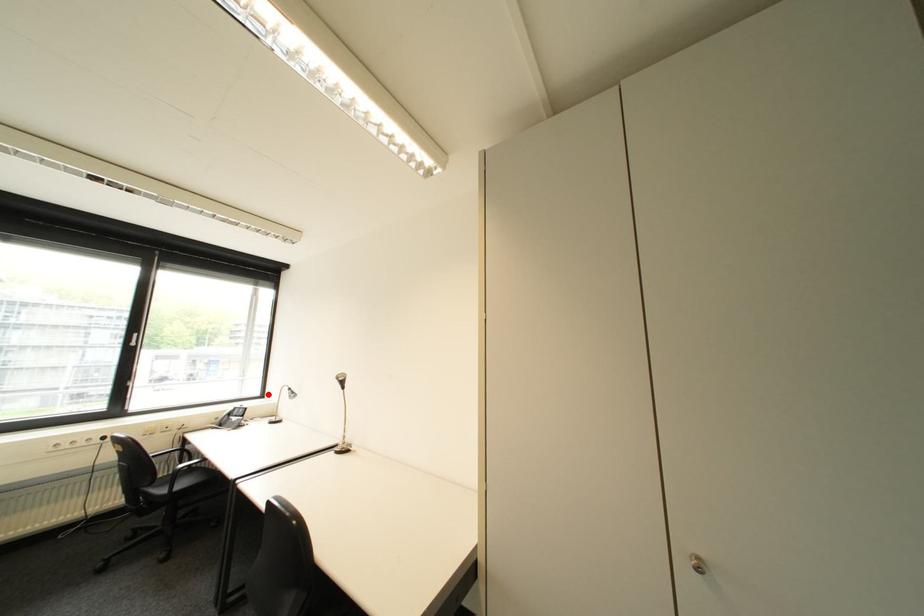
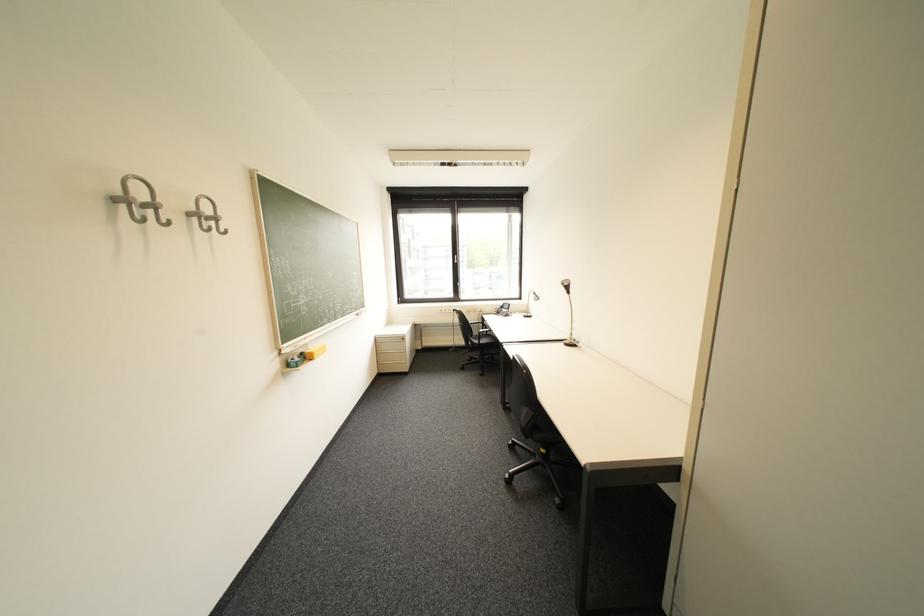
Question: I am providing you with two images of the same scene from different viewpoints. Given a red point in image1, look at the same physical point in image2. Is it:

Choices:
 (A) Closer to the viewpoint
 (B) Farther from the viewpoint

Answer: (A)